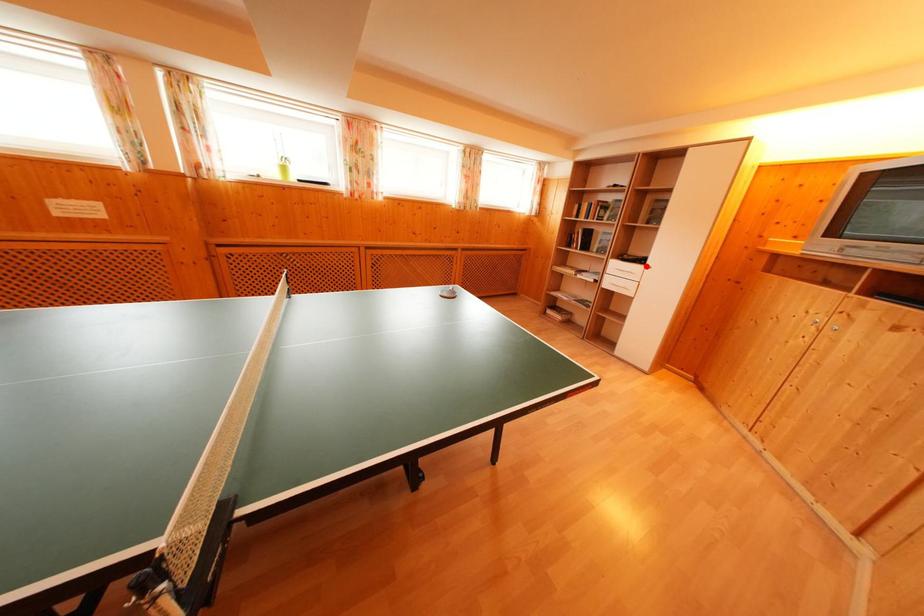
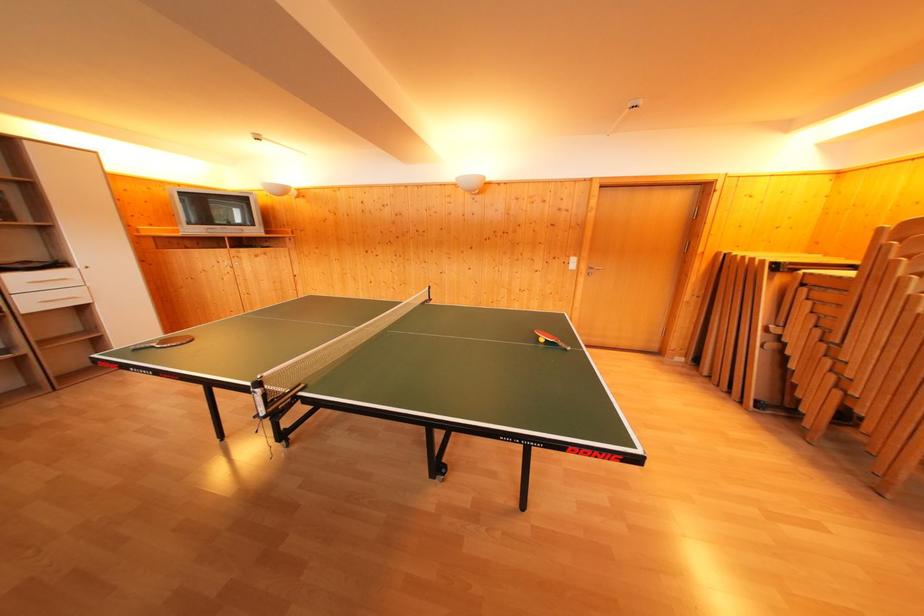
Question: I am providing you with two images of the same scene from different viewpoints. Image1 has a red point marked. In image2, the corresponding 3D location appears at what relative position? Reply with the corresponding letter.

Choices:
 (A) Closer
 (B) Farther

Answer: (B)